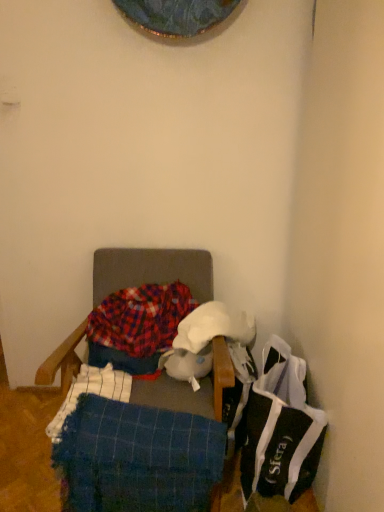
Question: From a real-world perspective, is blue woven blanket at lower left, positioned as the 1th blanket in front-to-back order, on black fabric bag at lower right?

Choices:
 (A) yes
 (B) no

Answer: (A)

Question: Is blue woven blanket at lower left, positioned as the 1th blanket in front-to-back order, oriented away from black fabric bag at lower right?

Choices:
 (A) no
 (B) yes

Answer: (B)

Question: Is blue woven blanket at lower left, arranged as the 2th blanket when viewed from the top, outside of black fabric bag at lower right?

Choices:
 (A) no
 (B) yes

Answer: (B)

Question: Is blue woven blanket at lower left, positioned as the 1th blanket in front-to-back order, oriented towards black fabric bag at lower right?

Choices:
 (A) no
 (B) yes

Answer: (A)

Question: Does blue woven blanket at lower left, positioned as the 1th blanket in front-to-back order, have a greater height compared to black fabric bag at lower right?

Choices:
 (A) no
 (B) yes

Answer: (A)

Question: Is black fabric bag at lower right wider or thinner than blue woven blanket at lower left, which is the first blanket from bottom to top?

Choices:
 (A) wide
 (B) thin

Answer: (A)

Question: Looking at the image, does black fabric bag at lower right seem bigger or smaller compared to blue woven blanket at lower left, positioned as the 2th blanket in back-to-front order?

Choices:
 (A) big
 (B) small

Answer: (A)

Question: From the image's perspective, is black fabric bag at lower right positioned above or below blue woven blanket at lower left, which is the first blanket from bottom to top?

Choices:
 (A) below
 (B) above

Answer: (B)

Question: Is point (302, 419) closer or farther from the camera than point (61, 458)?

Choices:
 (A) closer
 (B) farther

Answer: (B)

Question: Based on their sizes in the image, would you say black fabric bag at lower right is bigger or smaller than plaid fabric blanket at center, the 1th blanket from the top?

Choices:
 (A) small
 (B) big

Answer: (B)

Question: Looking at their shapes, would you say black fabric bag at lower right is wider or thinner than plaid fabric blanket at center, acting as the 1th blanket starting from the back?

Choices:
 (A) wide
 (B) thin

Answer: (A)

Question: Considering the positions of black fabric bag at lower right and plaid fabric blanket at center, which ranks as the 2th blanket in bottom-to-top order, in the image, is black fabric bag at lower right taller or shorter than plaid fabric blanket at center, which ranks as the 2th blanket in bottom-to-top order,?

Choices:
 (A) short
 (B) tall

Answer: (B)

Question: Considering the relative positions of black fabric bag at lower right and plaid fabric blanket at center, which ranks as the 2th blanket in bottom-to-top order, in the image provided, is black fabric bag at lower right to the left or to the right of plaid fabric blanket at center, which ranks as the 2th blanket in bottom-to-top order,?

Choices:
 (A) right
 (B) left

Answer: (A)

Question: Is blue woven blanket at lower left, positioned as the 2th blanket in back-to-front order, wider or thinner than plaid fabric chair at center?

Choices:
 (A) wide
 (B) thin

Answer: (B)

Question: From a real-world perspective, relative to plaid fabric chair at center, is blue woven blanket at lower left, arranged as the 2th blanket when viewed from the top, vertically above or below?

Choices:
 (A) above
 (B) below

Answer: (B)